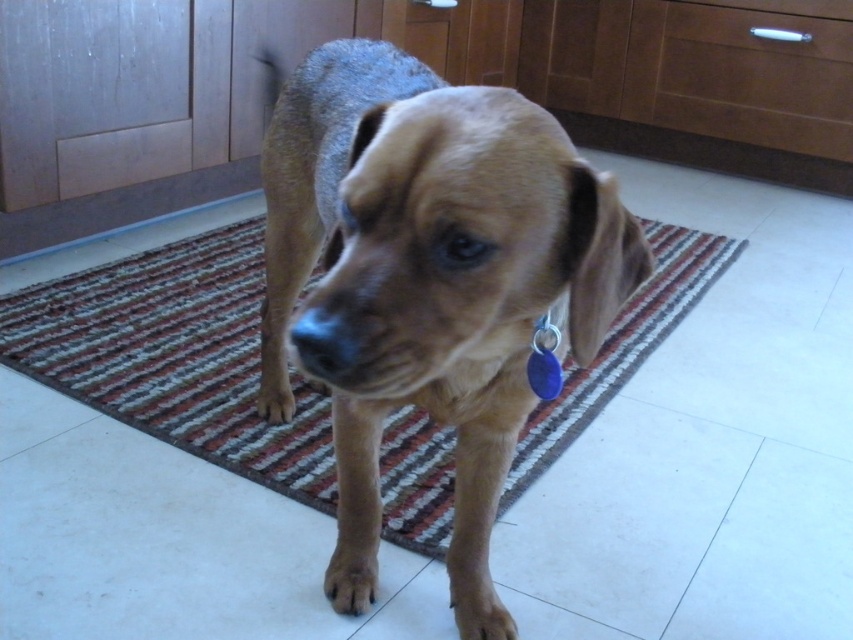
Question: Is brown matte dog at center thinner than brown striped rug at center?

Choices:
 (A) no
 (B) yes

Answer: (B)

Question: Which point appears closest to the camera in this image?

Choices:
 (A) (474, 177)
 (B) (233, 296)

Answer: (A)

Question: Is brown matte dog at center behind brown striped rug at center?

Choices:
 (A) no
 (B) yes

Answer: (A)

Question: Which point is farther from the camera taking this photo?

Choices:
 (A) (637, 330)
 (B) (370, 596)

Answer: (A)

Question: Does brown matte dog at center appear on the left side of brown striped rug at center?

Choices:
 (A) yes
 (B) no

Answer: (A)